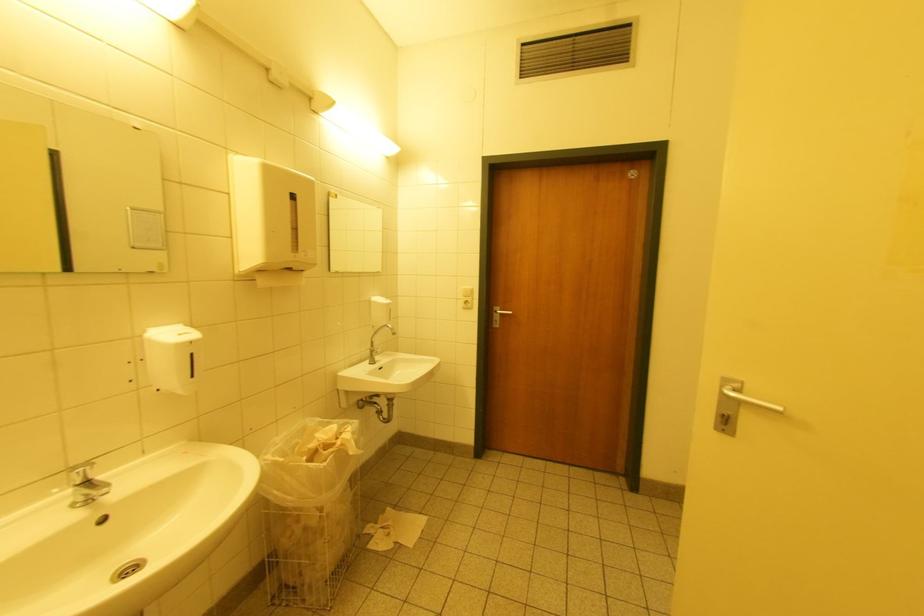
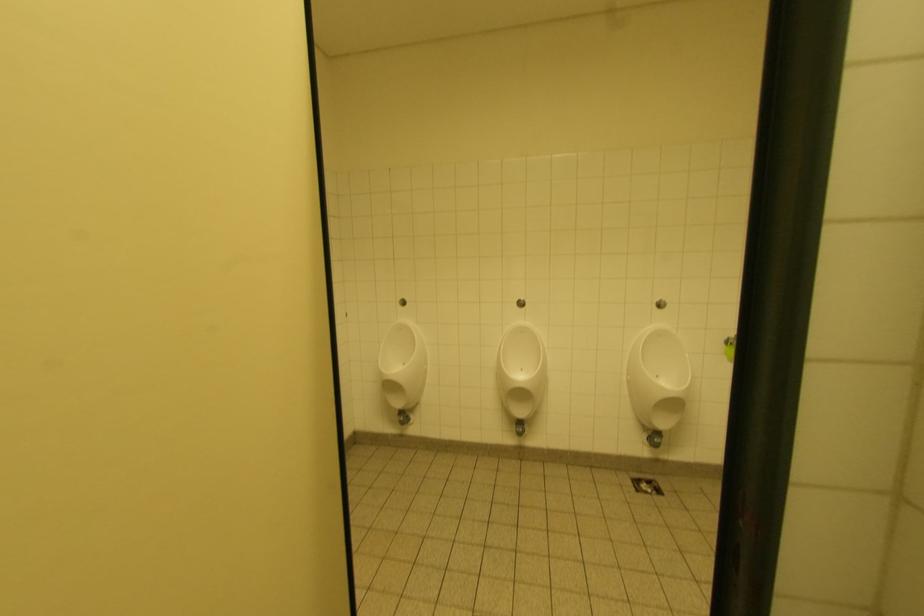
What movement of the cameraman would produce the second image?

The cameraman walked toward right, backward.